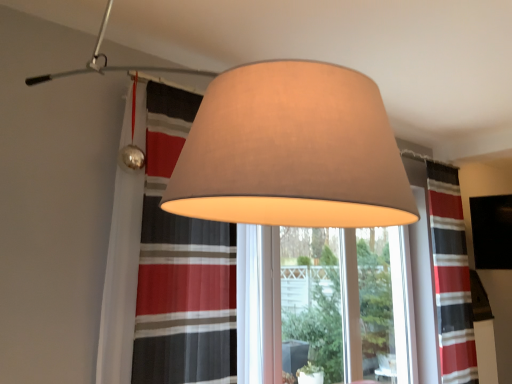
This screenshot has width=512, height=384. Identify the location of matte beige lampshade at upper center. (119, 282).

Measure the distance between point (x=358, y=311) and camera.

3.54 meters.

This screenshot has height=384, width=512. What do you see at coordinates (292, 151) in the screenshot? I see `matte gray lampshade at center, placed as the second lamp when sorted from back to front` at bounding box center [292, 151].

What is the approximate width of striped fabric curtain at right?

4.74 inches.

Find the location of a particular element. The height and width of the screenshot is (384, 512). matte beige lampshade at upper center is located at coordinates [119, 282].

Which lamp is the 2nd one when counting from the left side of the striped fabric curtain at right? Please provide its 2D coordinates.

[(292, 151)]

Which is more distant, (453, 330) or (291, 181)?

The point (453, 330) is farther.

Is striped fabric curtain at right to the left or to the right of matte gray lampshade at center, placed as the second lamp when sorted from back to front, in the image?

Clearly, striped fabric curtain at right is on the right of matte gray lampshade at center, placed as the second lamp when sorted from back to front, in the image.

Locate an element on the screen. Image resolution: width=512 pixels, height=384 pixels. curtain on the right of matte beige lampshade at upper center, acting as the first lamp starting from the back is located at coordinates [451, 277].

Is striped fabric curtain at right located outside matte beige lampshade at upper center, the second lamp positioned from the front?

striped fabric curtain at right lies outside matte beige lampshade at upper center, the second lamp positioned from the front,'s area.

From a real-world perspective, between striped fabric curtain at right and matte beige lampshade at upper center, acting as the first lamp starting from the back, who is vertically higher?

matte beige lampshade at upper center, acting as the first lamp starting from the back, is physically above.

Which is more to the left, striped fabric curtain at right or matte beige lampshade at upper center, acting as the first lamp starting from the back?

matte beige lampshade at upper center, acting as the first lamp starting from the back.

Does point (130, 289) come farther from viewer compared to point (251, 374)?

No, it is not.

The width and height of the screenshot is (512, 384). What are the coordinates of `window frame below the matte beige lampshade at upper center (from a real-world perspective)` in the screenshot? It's located at (258, 304).

Choose the correct answer: Is matte beige lampshade at upper center inside clear glass window frame at center or outside it?

matte beige lampshade at upper center cannot be found inside clear glass window frame at center.

Which object is wider, matte beige lampshade at upper center or clear glass window frame at center?

With larger width is matte beige lampshade at upper center.

Considering the sizes of matte beige lampshade at upper center, the second lamp positioned from the front, and matte gray lampshade at center, placed as the second lamp when sorted from back to front, in the image, is matte beige lampshade at upper center, the second lamp positioned from the front, taller or shorter than matte gray lampshade at center, placed as the second lamp when sorted from back to front,?

Considering their sizes, matte beige lampshade at upper center, the second lamp positioned from the front, has less height than matte gray lampshade at center, placed as the second lamp when sorted from back to front.

Is matte beige lampshade at upper center, acting as the first lamp starting from the back, smaller than matte gray lampshade at center, the first lamp when ordered from front to back?

Correct, matte beige lampshade at upper center, acting as the first lamp starting from the back, occupies less space than matte gray lampshade at center, the first lamp when ordered from front to back.

Does matte beige lampshade at upper center, acting as the first lamp starting from the back, contain matte gray lampshade at center, the first lamp when ordered from front to back?

No, matte gray lampshade at center, the first lamp when ordered from front to back, is not inside matte beige lampshade at upper center, acting as the first lamp starting from the back.

From a real-world perspective, who is located lower, matte gray lampshade at center, placed as the second lamp when sorted from back to front, or striped fabric curtain at right?

In real-world perspective, striped fabric curtain at right is lower.

How distant is matte gray lampshade at center, placed as the second lamp when sorted from back to front, from striped fabric curtain at right?

The distance of matte gray lampshade at center, placed as the second lamp when sorted from back to front, from striped fabric curtain at right is 3.12 meters.

Which lamp is the 2nd one when counting from the left side of the striped fabric curtain at right? Please provide its 2D coordinates.

[(292, 151)]

Considering the sizes of objects matte gray lampshade at center, the first lamp when ordered from front to back, and striped fabric curtain at right in the image provided, who is wider, matte gray lampshade at center, the first lamp when ordered from front to back, or striped fabric curtain at right?

Wider between the two is matte gray lampshade at center, the first lamp when ordered from front to back.

Is matte beige lampshade at upper center wider or thinner than matte beige lampshade at upper center, acting as the first lamp starting from the back?

Considering their sizes, matte beige lampshade at upper center looks broader than matte beige lampshade at upper center, acting as the first lamp starting from the back.

Does matte beige lampshade at upper center come in front of matte beige lampshade at upper center, acting as the first lamp starting from the back?

Yes, the depth of matte beige lampshade at upper center is less than that of matte beige lampshade at upper center, acting as the first lamp starting from the back.

Is matte beige lampshade at upper center, the second lamp positioned from the front, completely or partially inside matte beige lampshade at upper center?

No, matte beige lampshade at upper center does not contain matte beige lampshade at upper center, the second lamp positioned from the front.

Relative to matte beige lampshade at upper center, is matte gray lampshade at center, the first lamp when ordered from front to back, in front or behind?

matte gray lampshade at center, the first lamp when ordered from front to back, is in front of matte beige lampshade at upper center.

From a real-world perspective, who is located lower, matte gray lampshade at center, placed as the second lamp when sorted from back to front, or matte beige lampshade at upper center?

matte beige lampshade at upper center is physically lower.

Is matte gray lampshade at center, placed as the second lamp when sorted from back to front, not inside matte beige lampshade at upper center?

Indeed, matte gray lampshade at center, placed as the second lamp when sorted from back to front, is completely outside matte beige lampshade at upper center.

From the image's perspective, is matte gray lampshade at center, placed as the second lamp when sorted from back to front, located above or below matte beige lampshade at upper center?

matte gray lampshade at center, placed as the second lamp when sorted from back to front, is above matte beige lampshade at upper center.

Locate an element on the screen. This screenshot has height=384, width=512. curtain on the right of matte gray lampshade at center, the first lamp when ordered from front to back is located at coordinates (451, 277).

In order to click on curtain below the matte beige lampshade at upper center, acting as the first lamp starting from the back (from a real-world perspective) in this screenshot , I will do `click(451, 277)`.

Consider the image. When comparing their distances from matte beige lampshade at upper center, does striped fabric curtain at right or matte gray lampshade at center, placed as the second lamp when sorted from back to front, seem further?

striped fabric curtain at right is further to matte beige lampshade at upper center.

From the picture: Estimate the real-world distances between objects in this image. Which object is closer to clear glass window frame at center, matte gray lampshade at center, placed as the second lamp when sorted from back to front, or matte beige lampshade at upper center, acting as the first lamp starting from the back?

matte gray lampshade at center, placed as the second lamp when sorted from back to front, lies closer to clear glass window frame at center than the other object.

Based on their spatial positions, is striped fabric curtain at right or matte gray lampshade at center, the first lamp when ordered from front to back, closer to matte beige lampshade at upper center, acting as the first lamp starting from the back?

The object closer to matte beige lampshade at upper center, acting as the first lamp starting from the back, is matte gray lampshade at center, the first lamp when ordered from front to back.

When comparing their distances from matte beige lampshade at upper center, acting as the first lamp starting from the back, does clear glass window frame at center or matte gray lampshade at center, the first lamp when ordered from front to back, seem closer?

matte gray lampshade at center, the first lamp when ordered from front to back, is closer to matte beige lampshade at upper center, acting as the first lamp starting from the back.

Considering their positions, is matte beige lampshade at upper center, acting as the first lamp starting from the back, positioned closer to matte beige lampshade at upper center than clear glass window frame at center?

clear glass window frame at center is closer to matte beige lampshade at upper center.

Which object lies nearer to the anchor point matte gray lampshade at center, placed as the second lamp when sorted from back to front, matte beige lampshade at upper center, the second lamp positioned from the front, or striped fabric curtain at right?

matte beige lampshade at upper center, the second lamp positioned from the front, lies closer to matte gray lampshade at center, placed as the second lamp when sorted from back to front, than the other object.

Looking at the image, which one is located closer to striped fabric curtain at right, matte gray lampshade at center, the first lamp when ordered from front to back, or clear glass window frame at center?

clear glass window frame at center is positioned closer to the anchor striped fabric curtain at right.

When comparing their distances from matte beige lampshade at upper center, does matte beige lampshade at upper center, acting as the first lamp starting from the back, or striped fabric curtain at right seem closer?

matte beige lampshade at upper center, acting as the first lamp starting from the back, is positioned closer to the anchor matte beige lampshade at upper center.

This screenshot has width=512, height=384. I want to click on bay window positioned between matte gray lampshade at center, the first lamp when ordered from front to back, and matte beige lampshade at upper center, the second lamp positioned from the front, from near to far, so click(x=119, y=282).

Identify the location of bay window between matte gray lampshade at center, the first lamp when ordered from front to back, and clear glass window frame at center from front to back. The height and width of the screenshot is (384, 512). (119, 282).

Locate an element on the screen. The height and width of the screenshot is (384, 512). window frame between matte gray lampshade at center, placed as the second lamp when sorted from back to front, and striped fabric curtain at right in the front-back direction is located at coordinates (258, 304).

Where is `window frame between matte beige lampshade at upper center and striped fabric curtain at right in the horizontal direction`? The height and width of the screenshot is (384, 512). window frame between matte beige lampshade at upper center and striped fabric curtain at right in the horizontal direction is located at coordinates (258, 304).